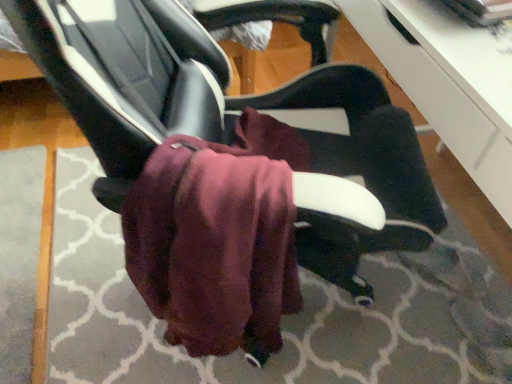
Image resolution: width=512 pixels, height=384 pixels. What do you see at coordinates (213, 245) in the screenshot?
I see `burgundy fleece bath towel at center` at bounding box center [213, 245].

You are a GUI agent. You are given a task and a screenshot of the screen. Output one action in this format:
    pyautogui.click(x=<x>, y=<y>)
    Task: Click on the maroon fabric at center
    
    Given the screenshot: What is the action you would take?
    pyautogui.click(x=285, y=317)

At what (x,y) coordinates should I click in order to perform the action: click on bath towel behind the matte black chair at center. Please return your answer as a coordinate pair (x, y). Looking at the image, I should click on (213, 245).

Considering the positions of points (284, 188) and (332, 275), is point (284, 188) farther from camera compared to point (332, 275)?

No.

Is burgundy fleece bath towel at center turned away from matte black chair at center?

Yes, burgundy fleece bath towel at center is positioned with its back facing matte black chair at center.

From the image's perspective, is burgundy fleece bath towel at center above or below matte black chair at center?

Clearly, from the image's perspective, burgundy fleece bath towel at center is below matte black chair at center.

Is maroon fabric at center positioned with its back to matte black chair at center?

Absolutely, maroon fabric at center is directed away from matte black chair at center.

From the image's perspective, relative to matte black chair at center, is maroon fabric at center above or below?

maroon fabric at center is below matte black chair at center.

Is maroon fabric at center placed right next to matte black chair at center?

No, maroon fabric at center is not in contact with matte black chair at center.

Can you confirm if maroon fabric at center is taller than matte black chair at center?

No.

Is maroon fabric at center aimed at burgundy fleece bath towel at center?

No, maroon fabric at center is not facing towards burgundy fleece bath towel at center.

Relative to burgundy fleece bath towel at center, is maroon fabric at center in front or behind?

Clearly, maroon fabric at center is behind burgundy fleece bath towel at center.

Can you tell me how much maroon fabric at center and burgundy fleece bath towel at center differ in facing direction?

There is a 14.5-degree angle between the facing directions of maroon fabric at center and burgundy fleece bath towel at center.

Visually, is maroon fabric at center positioned to the left or to the right of burgundy fleece bath towel at center?

Based on their positions, maroon fabric at center is located to the right of burgundy fleece bath towel at center.

Is matte black chair at center next to maroon fabric at center?

No, matte black chair at center is not in contact with maroon fabric at center.

Is matte black chair at center surrounding maroon fabric at center?

No, maroon fabric at center is not surrounded by matte black chair at center.

Can you confirm if matte black chair at center is wider than maroon fabric at center?

Incorrect, the width of matte black chair at center does not surpass that of maroon fabric at center.

Considering the positions of objects matte black chair at center and maroon fabric at center in the image provided, who is more to the left, matte black chair at center or maroon fabric at center?

From the viewer's perspective, matte black chair at center appears more on the left side.

How different are the orientations of matte black chair at center and burgundy fleece bath towel at center in degrees?

They differ by 0.000636 degrees in their facing directions.

In terms of width, does matte black chair at center look wider or thinner when compared to burgundy fleece bath towel at center?

matte black chair at center is wider than burgundy fleece bath towel at center.

Consider the image. From a real-world perspective, is matte black chair at center located higher than burgundy fleece bath towel at center?

Indeed, from a real-world perspective, matte black chair at center stands above burgundy fleece bath towel at center.

Who is shorter, matte black chair at center or burgundy fleece bath towel at center?

burgundy fleece bath towel at center.

Is burgundy fleece bath towel at center inside or outside of maroon fabric at center?

burgundy fleece bath towel at center is not enclosed by maroon fabric at center.

In the scene shown: Which is farther from the camera, (220, 280) or (451, 323)?

The point (451, 323) is farther from the camera.

Is burgundy fleece bath towel at center bigger or smaller than maroon fabric at center?

Clearly, burgundy fleece bath towel at center is smaller in size than maroon fabric at center.

From a real-world perspective, which is physically below, burgundy fleece bath towel at center or maroon fabric at center?

From a 3D spatial view, maroon fabric at center is below.

At what (x,y) coordinates should I click in order to perform the action: click on bath towel behind the matte black chair at center. Please return your answer as a coordinate pair (x, y). The width and height of the screenshot is (512, 384). Looking at the image, I should click on (213, 245).

Image resolution: width=512 pixels, height=384 pixels. Find the location of `chair in front of the maroon fabric at center`. chair in front of the maroon fabric at center is located at coordinates (238, 116).

From the image, which object appears to be nearer to maroon fabric at center, matte black chair at center or burgundy fleece bath towel at center?

burgundy fleece bath towel at center is positioned closer to the anchor maroon fabric at center.

From the image, which object appears to be nearer to burgundy fleece bath towel at center, maroon fabric at center or matte black chair at center?

Based on the image, matte black chair at center appears to be nearer to burgundy fleece bath towel at center.

From the image, which object appears to be nearer to matte black chair at center, maroon fabric at center or burgundy fleece bath towel at center?

Among the two, burgundy fleece bath towel at center is located nearer to matte black chair at center.

From the image, which object appears to be farther from burgundy fleece bath towel at center, matte black chair at center or maroon fabric at center?

Among the two, maroon fabric at center is located further to burgundy fleece bath towel at center.

Looking at this image, estimate the real-world distances between objects in this image. Which object is further from maroon fabric at center, burgundy fleece bath towel at center or matte black chair at center?

Among the two, matte black chair at center is located further to maroon fabric at center.

From the image, which object appears to be nearer to matte black chair at center, burgundy fleece bath towel at center or maroon fabric at center?

burgundy fleece bath towel at center is closer to matte black chair at center.

This screenshot has width=512, height=384. In order to click on bath towel between matte black chair at center and maroon fabric at center from front to back in this screenshot , I will do `click(213, 245)`.